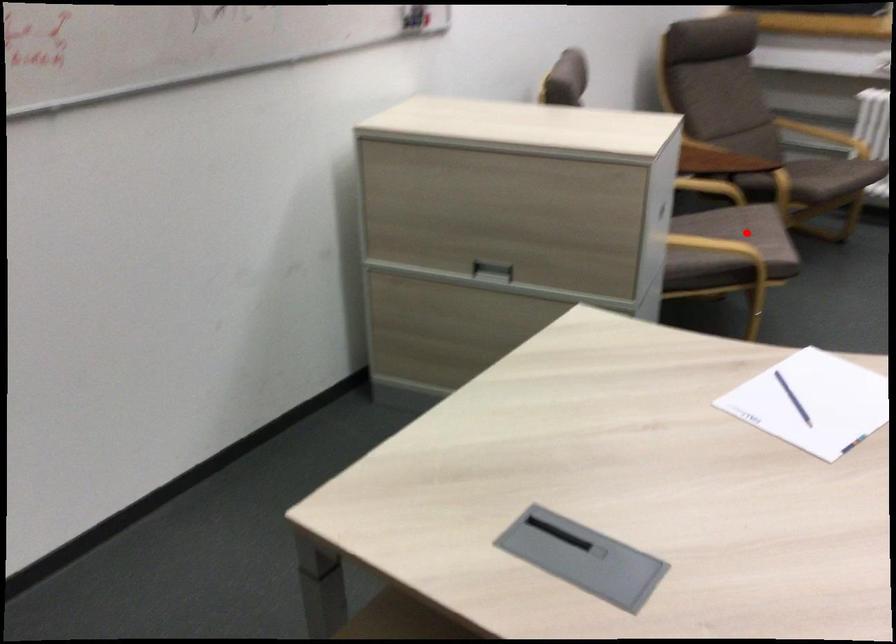
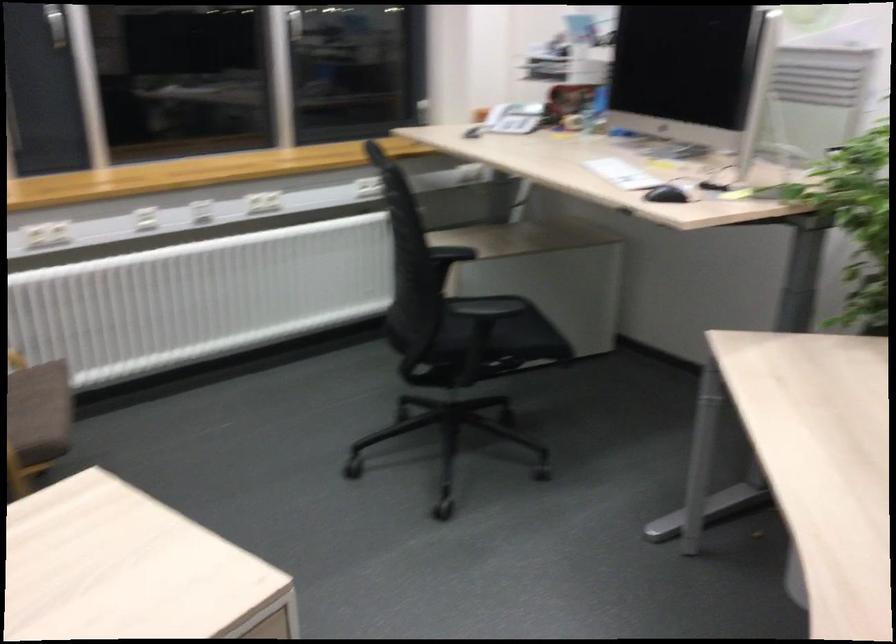
Question: I am providing you with two images of the same scene from different viewpoints. A red point is marked on the first image. At the location where the point appears in image 1, is it still visible in image 2?

Choices:
 (A) Yes
 (B) No

Answer: (B)